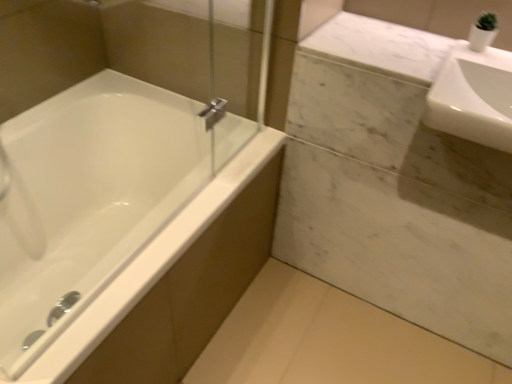
Image resolution: width=512 pixels, height=384 pixels. What do you see at coordinates (109, 208) in the screenshot?
I see `white glossy bathtub at left` at bounding box center [109, 208].

The width and height of the screenshot is (512, 384). Identify the location of white glossy bathtub at left. coord(109,208).

What do you see at coordinates (473, 96) in the screenshot?
I see `white glossy sink at upper right` at bounding box center [473, 96].

Measure the distance between point (485, 59) and camera.

Point (485, 59) and camera are 3.55 feet apart from each other.

Locate an element on the screen. white glossy sink at upper right is located at coordinates (473, 96).

This screenshot has height=384, width=512. I want to click on white glossy bathtub at left, so click(109, 208).

Is white glossy bathtub at left to the right of white glossy sink at upper right from the viewer's perspective?

No, white glossy bathtub at left is not to the right of white glossy sink at upper right.

Considering the relative positions of white glossy bathtub at left and white glossy sink at upper right in the image provided, is white glossy bathtub at left behind white glossy sink at upper right?

No, it is in front of white glossy sink at upper right.

Is point (94, 300) closer or farther from the camera than point (482, 127)?

Point (94, 300).

From the image's perspective, is white glossy bathtub at left above white glossy sink at upper right?

Actually, white glossy bathtub at left appears below white glossy sink at upper right in the image.

From a real-world perspective, does white glossy bathtub at left stand above white glossy sink at upper right?

No, from a real-world perspective, white glossy bathtub at left is not above white glossy sink at upper right.

Does white glossy bathtub at left have a greater width compared to white glossy sink at upper right?

Yes.

Which of these two, white glossy bathtub at left or white glossy sink at upper right, stands taller?

Standing taller between the two is white glossy bathtub at left.

Is white glossy bathtub at left bigger or smaller than white glossy sink at upper right?

white glossy bathtub at left is bigger than white glossy sink at upper right.

Is white glossy bathtub at left inside or outside of white glossy sink at upper right?

white glossy bathtub at left lies outside white glossy sink at upper right.

Is white glossy bathtub at left not close to white glossy sink at upper right?

white glossy bathtub at left is near white glossy sink at upper right, not far away.

Is white glossy bathtub at left facing towards white glossy sink at upper right?

No, white glossy bathtub at left is not facing towards white glossy sink at upper right.

The height and width of the screenshot is (384, 512). I want to click on sink that appears behind the white glossy bathtub at left, so click(x=473, y=96).

Which is more to the right, white glossy sink at upper right or white glossy bathtub at left?

From the viewer's perspective, white glossy sink at upper right appears more on the right side.

Between white glossy sink at upper right and white glossy bathtub at left, which one is positioned behind?

white glossy sink at upper right is more distant.

Is point (446, 60) positioned after point (83, 310)?

Yes, point (446, 60) is behind point (83, 310).

From the image's perspective, which object appears higher, white glossy sink at upper right or white glossy bathtub at left?

white glossy sink at upper right, from the image's perspective.

From a real-world perspective, which is physically above, white glossy sink at upper right or white glossy bathtub at left?

white glossy sink at upper right.

Considering the sizes of objects white glossy sink at upper right and white glossy bathtub at left in the image provided, who is wider, white glossy sink at upper right or white glossy bathtub at left?

white glossy bathtub at left is wider.

Which of these two, white glossy sink at upper right or white glossy bathtub at left, stands taller?

Standing taller between the two is white glossy bathtub at left.

Is white glossy sink at upper right smaller than white glossy bathtub at left?

Indeed, white glossy sink at upper right has a smaller size compared to white glossy bathtub at left.

Is white glossy sink at upper right completely or partially outside of white glossy bathtub at left?

white glossy sink at upper right is positioned outside white glossy bathtub at left.

Is white glossy sink at upper right beside white glossy bathtub at left?

They are not placed beside each other.

Is white glossy sink at upper right oriented towards white glossy bathtub at left?

No, white glossy sink at upper right is not aimed at white glossy bathtub at left.

Locate an element on the screen. sink above the white glossy bathtub at left (from a real-world perspective) is located at coordinates (473, 96).

Identify the location of sink lying behind the white glossy bathtub at left. The image size is (512, 384). (473, 96).

The image size is (512, 384). In order to click on bathtub below the white glossy sink at upper right (from the image's perspective) in this screenshot , I will do `click(109, 208)`.